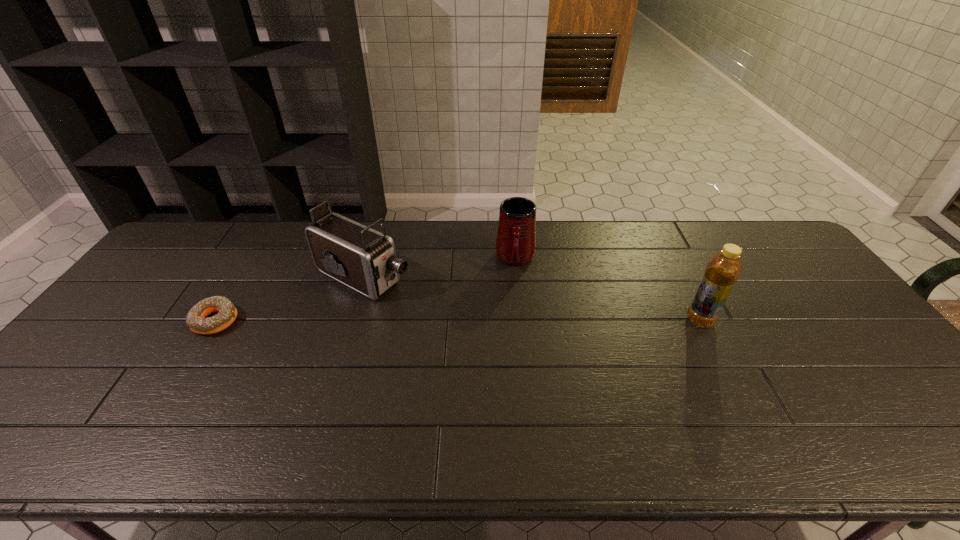
You are a GUI agent. You are given a task and a screenshot of the screen. Output one action in this format:
    pyautogui.click(x=<x>, y=<y>)
    Task: Click on the vacant space at the near left corner
    
    Given the screenshot: What is the action you would take?
    pyautogui.click(x=55, y=390)

Locate an element on the screen. vacant region at the far right corner of the desktop is located at coordinates (780, 261).

This screenshot has width=960, height=540. I want to click on free area in between the rightmost object and the shortest object, so point(458,321).

I want to click on free spot between the bottle and the third object from left to right, so click(608, 290).

Locate an element on the screen. This screenshot has height=540, width=960. vacant area between the second object from left to right and the mug is located at coordinates (440, 268).

At what (x,y) coordinates should I click in order to perform the action: click on free point between the bottle and the second object from left to right. Please return your answer as a coordinate pair (x, y). Image resolution: width=960 pixels, height=540 pixels. Looking at the image, I should click on (532, 299).

Find the location of a particular element. empty space that is in between the rightmost object and the third object from left to right is located at coordinates (608, 290).

Identify the location of blank region between the second shortest object and the bottle. (608, 290).

This screenshot has width=960, height=540. I want to click on free spot between the mug and the bottle, so 608,290.

I want to click on free space between the third object from right to left and the bottle, so click(x=532, y=299).